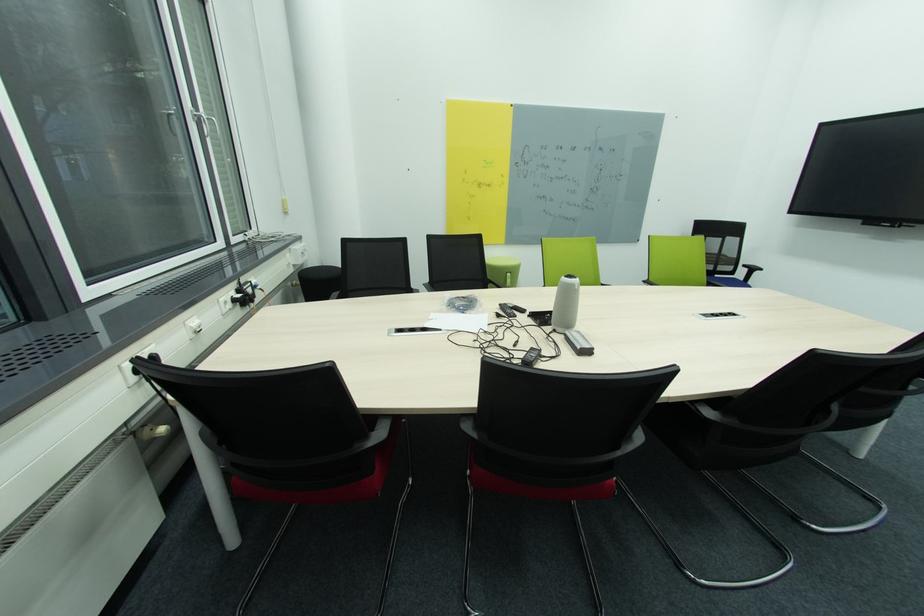
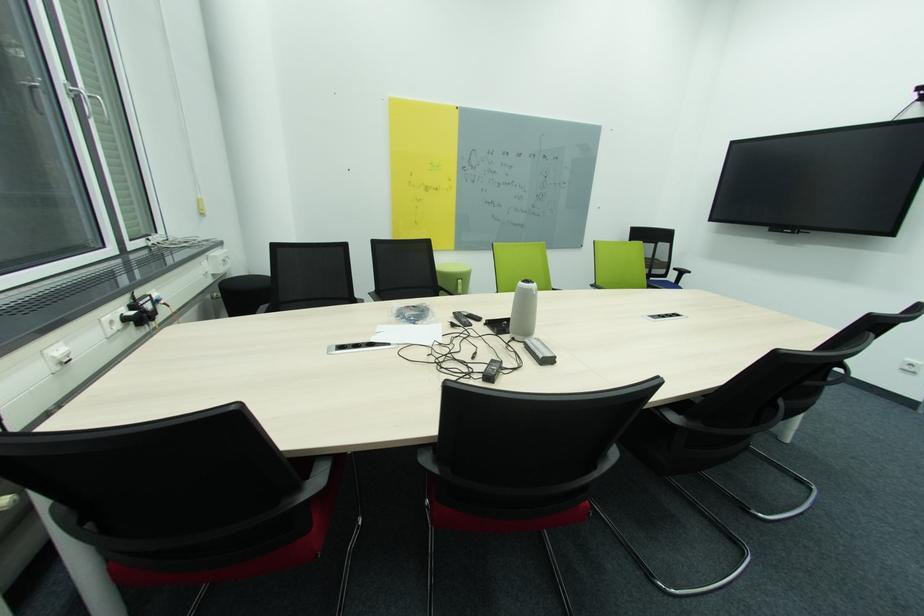
The point at (208, 116) is marked in the first image. Where is the corresponding point in the second image?

(88, 92)